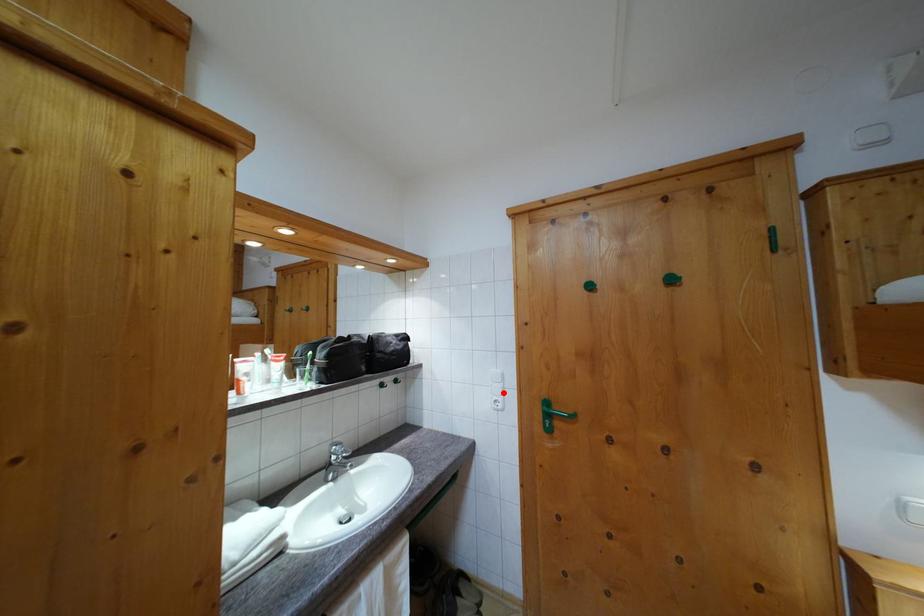
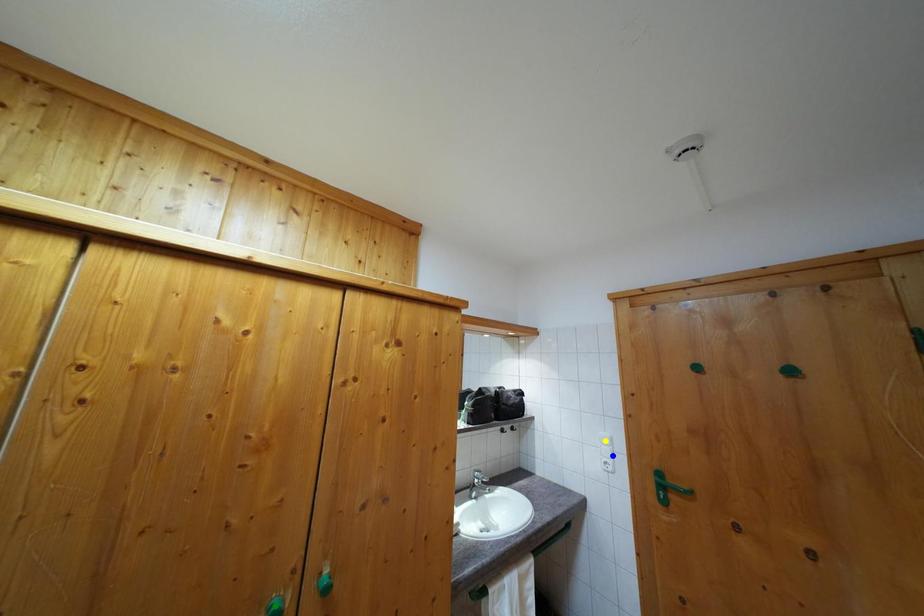
Question: I am providing you with two images of the same scene from different viewpoints. A red point is marked on the first image. You are given multiple points on the second image. Can you choose the point in image 2 that corresponds to the point in image 1?

Choices:
 (A) green point
 (B) yellow point
 (C) blue point

Answer: (C)